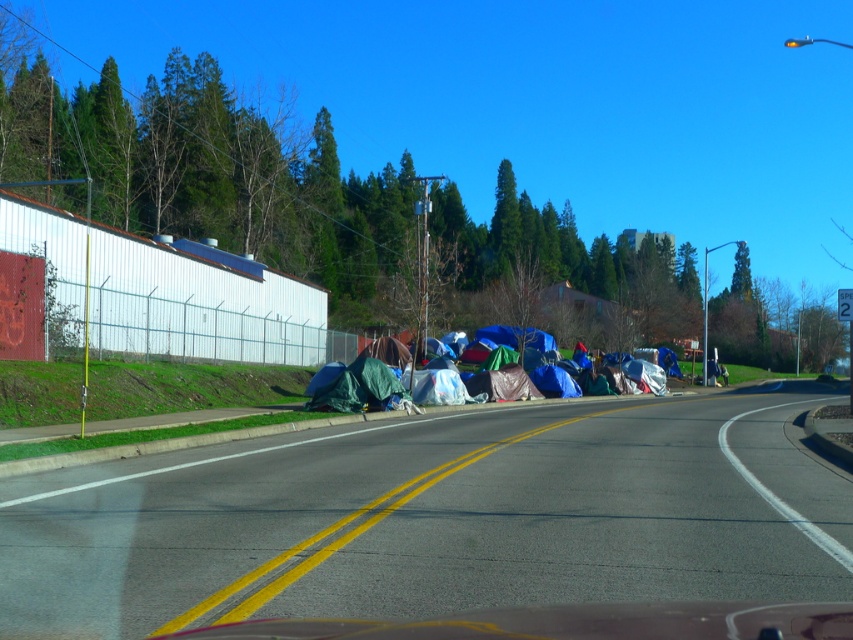
You are driving a car with a 5.2 meter length. The car is positioned at point (413, 419). You need to park your car in a space that is exactly 26.37 meters long. Is there enough space to park your car without overlapping any obstacles?

The parking space is exactly 26.37 meters long, and your car is 5.2 meters long. Since 26.37 meters is significantly longer than 5.2 meters, there is ample space to park the car without overlapping any obstacles.

You are driving a truck that is 3 meters wide and want to pass through the area where the asphalt road at lower center and the multicolored tarpaulin tents at center are located. Can your truck fit through the space between the tents and the road?

The asphalt road at lower center is positioned under the multicolored tarpaulin tents at center, so the tents are above the road. Since the truck is driving on the road, it will pass under the tents. The width of the road is not specified, but assuming it is wide enough for a 3 meter wide truck, the truck can fit through the space.